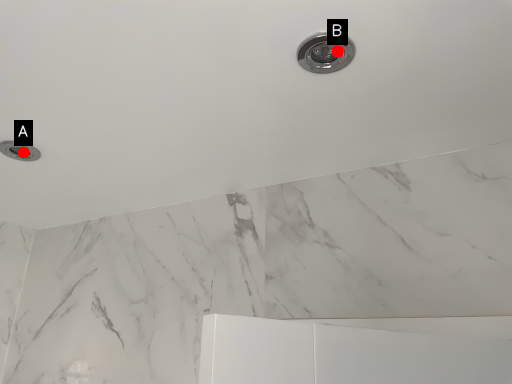
Question: Two points are circled on the image, labeled by A and B beside each circle. Which of the following is the closest to the observer?

Choices:
 (A) A is closer
 (B) B is closer

Answer: (B)